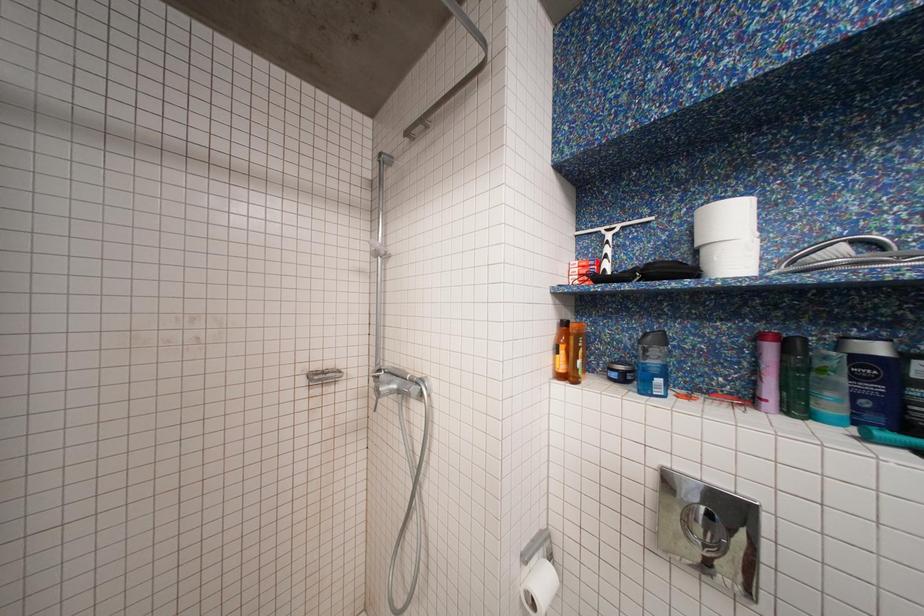
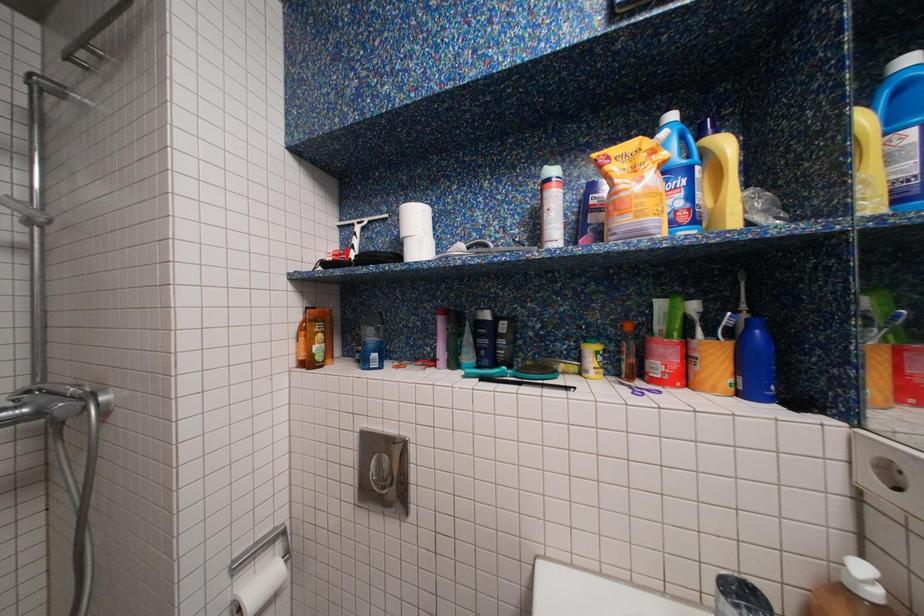
Question: The camera is either moving clockwise (left) or counter-clockwise (right) around the object. The first image is from the beginning of the video and the second image is from the end. Is the camera moving left or right when shooting the video?

Choices:
 (A) Left
 (B) Right

Answer: (A)